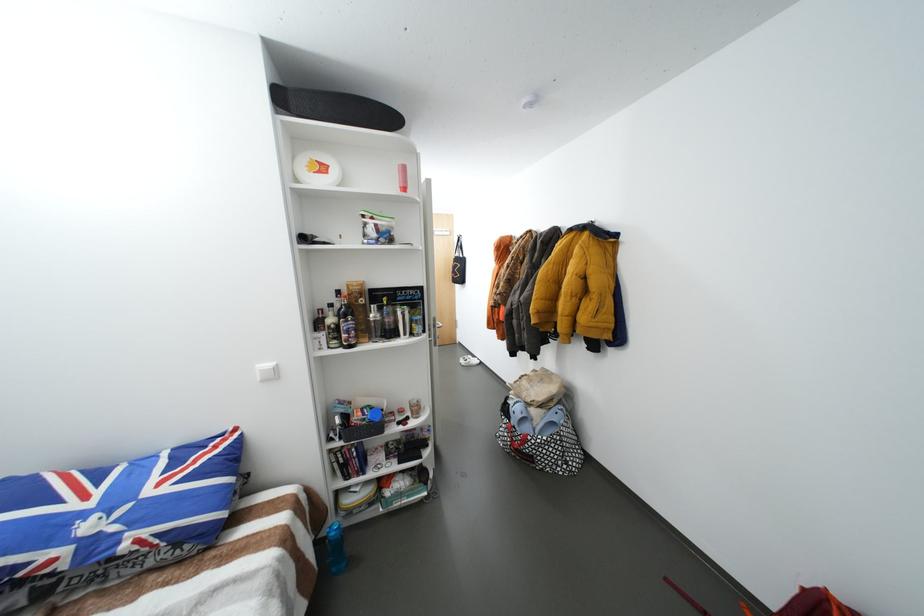
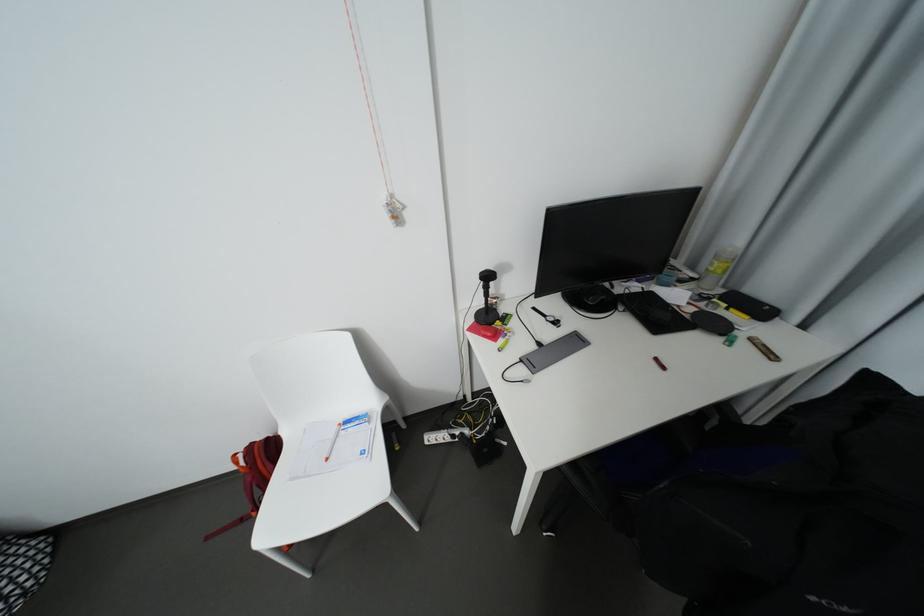
First-person continuous shooting, in which direction is the camera rotating?

The rotation direction of the camera is right-down.